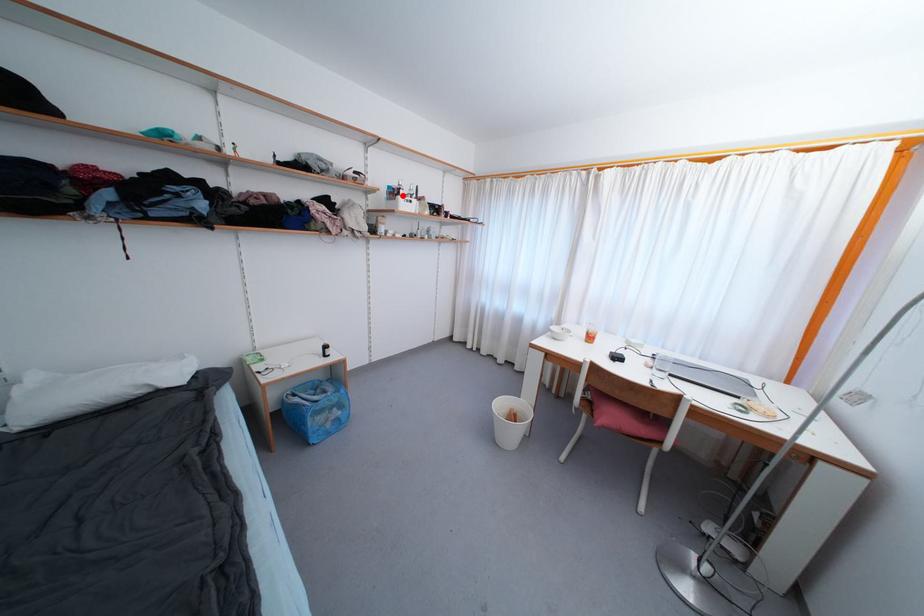
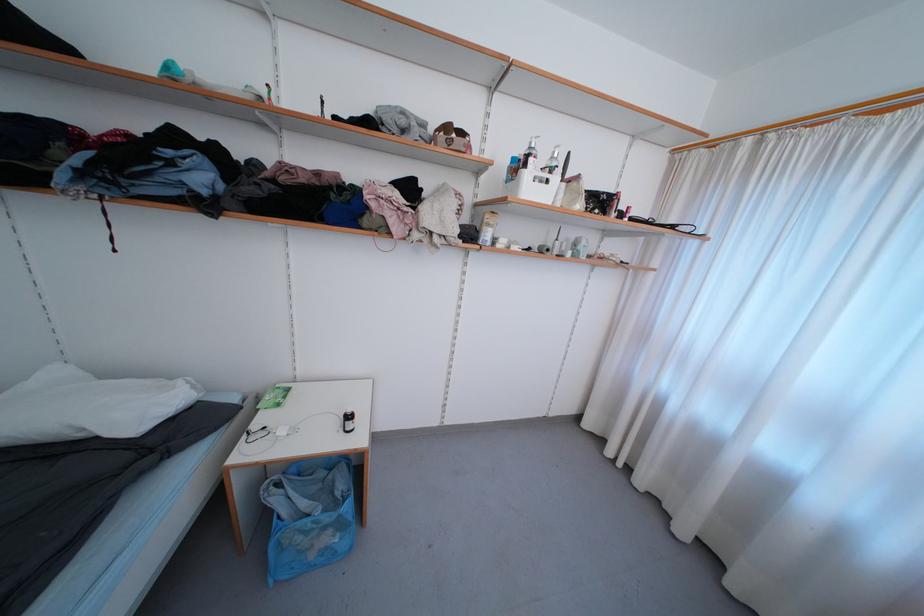
In the second image, find the point that corresponds to the highlighted location in the first image.

(529, 168)